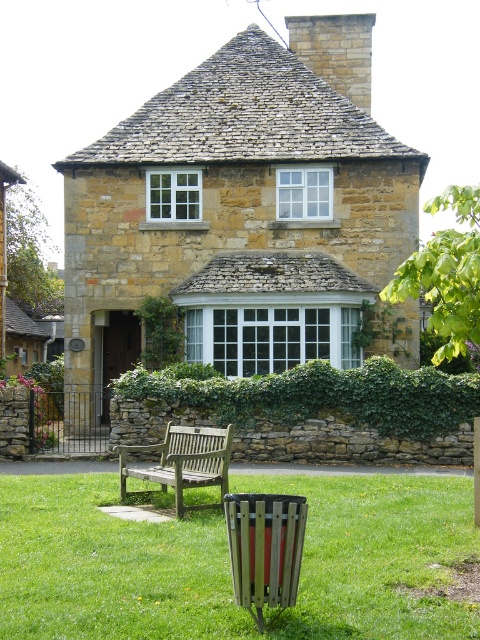
You are a gardener planning to mow the green grass at lower center and trim the green ivy hedge at center. Which area requires more effort in terms of width coverage?

The green grass at lower center requires more effort because its width is greater than the green ivy hedge at center.

You are a gardener planning to plant a row of flowers between the stone textured cottage at center and the green grass at lower center. Considering their sizes, which area will require more space for the flowers?

The stone textured cottage at center has a larger size compared to green grass at lower center, so planting flowers between them would require more space near the stone textured cottage at center.